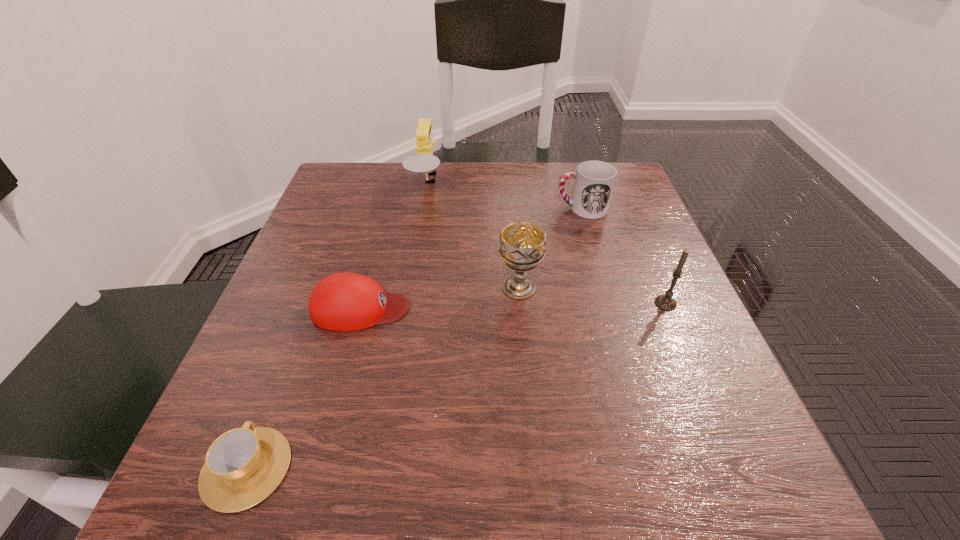
Find the location of a particular element. object at the near edge is located at coordinates (243, 466).

The image size is (960, 540). In order to click on baseball cap that is at the left edge in this screenshot , I will do `click(344, 301)`.

You are a GUI agent. You are given a task and a screenshot of the screen. Output one action in this format:
    pyautogui.click(x=<x>, y=<y>)
    Task: Click on the cup that is at the left edge
    This screenshot has width=960, height=540.
    Given the screenshot: What is the action you would take?
    pyautogui.click(x=243, y=466)

Identify the location of candle positioned at the right edge. The height and width of the screenshot is (540, 960). pos(666,302).

This screenshot has height=540, width=960. I want to click on cup present at the right edge, so click(x=594, y=180).

Find the location of `object at the near left corner`. object at the near left corner is located at coordinates (243, 466).

At what (x,y) coordinates should I click in order to perform the action: click on object that is at the far right corner. Please return your answer as a coordinate pair (x, y). The width and height of the screenshot is (960, 540). Looking at the image, I should click on (594, 180).

This screenshot has width=960, height=540. In the image, there is a desktop. What are the coordinates of `vacant space at the far edge` in the screenshot? It's located at (558, 185).

The image size is (960, 540). In the image, there is a desktop. In order to click on vacant space at the near edge in this screenshot , I will do `click(411, 451)`.

In the image, there is a desktop. In order to click on vacant space at the left edge in this screenshot , I will do `click(307, 326)`.